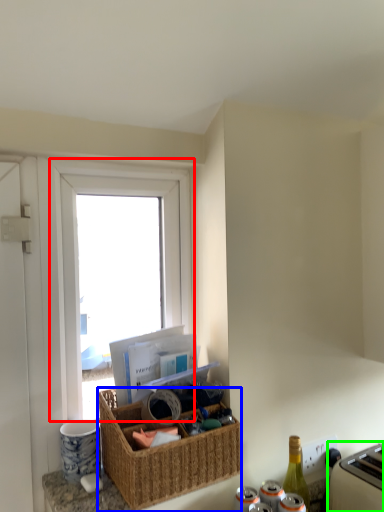
Question: Estimate the real-world distances between objects in this image. Which object is farther from window (highlighted by a red box), picnic basket (highlighted by a blue box) or appliance (highlighted by a green box)?

Choices:
 (A) picnic basket
 (B) appliance

Answer: (B)